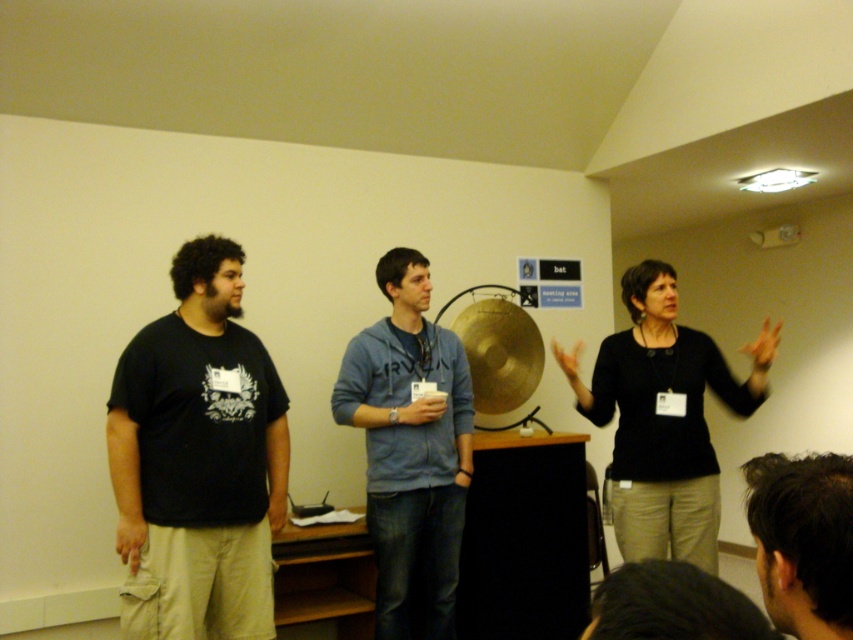
Between point (372, 444) and point (814, 516), which one is positioned behind?

Positioned behind is point (372, 444).

Can you confirm if blue cotton hoodie at center is shorter than dark brown hair at lower right?

Incorrect, blue cotton hoodie at center's height does not fall short of dark brown hair at lower right's.

Which is in front, point (370, 444) or point (838, 529)?

Point (838, 529) is in front.

What are the coordinates of `blue cotton hoodie at center` in the screenshot? It's located at (410, 451).

Which is above, dark brown hair at lower right or gold metallic cymbal at center?

gold metallic cymbal at center

Does dark brown hair at lower right lie behind gold metallic cymbal at center?

No, dark brown hair at lower right is in front of gold metallic cymbal at center.

Measure the distance between point (x=778, y=518) and camera.

1.05 meters

Locate an element on the screen. This screenshot has width=853, height=640. dark brown hair at lower right is located at coordinates (804, 540).

Can you confirm if black matte t-shirt at left is positioned to the right of blue cotton hoodie at center?

No, black matte t-shirt at left is not to the right of blue cotton hoodie at center.

Measure the distance between point (213, 460) and camera.

They are 8.21 feet apart.

This screenshot has width=853, height=640. What are the coordinates of `black matte t-shirt at left` in the screenshot? It's located at (198, 460).